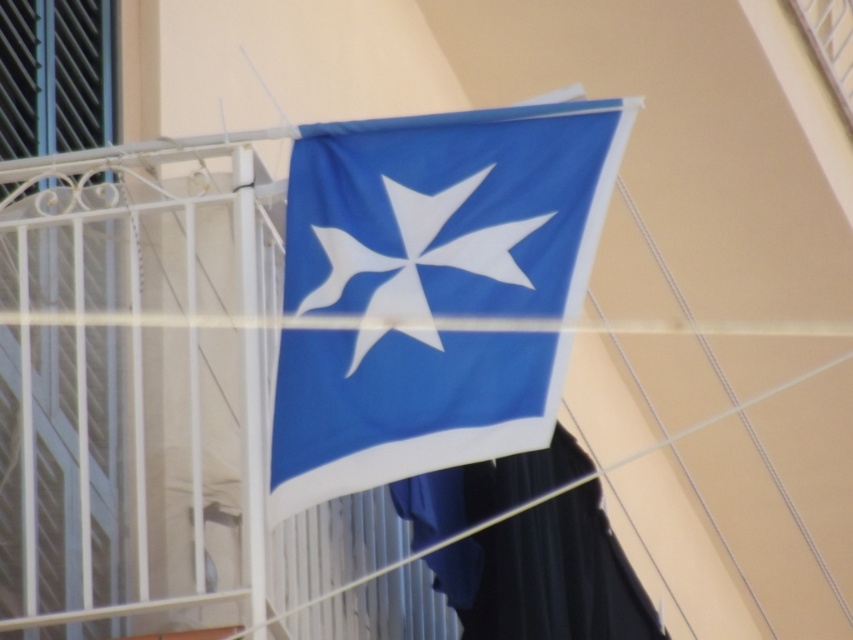
Is blue fabric flag at center to the right of white fabric star at center from the viewer's perspective?

Indeed, blue fabric flag at center is positioned on the right side of white fabric star at center.

Can you confirm if blue fabric flag at center is taller than white fabric star at center?

Incorrect, blue fabric flag at center's height is not larger of white fabric star at center's.

Is point (364, 280) positioned behind point (460, 246)?

Yes, point (364, 280) is farther from viewer.

Find the location of `blue fabric flag at center`. blue fabric flag at center is located at coordinates (451, 211).